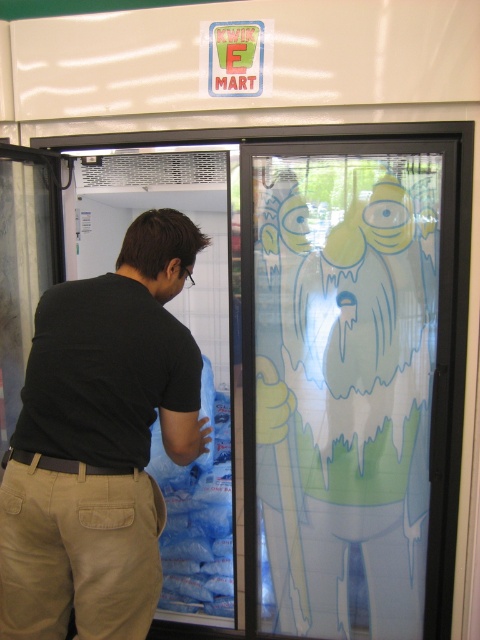
You are a store employee who needs to hang a small price tag on the refrigerator door. The tag must be placed at the height of the black matte shirt at center and the khaki cotton pants at lower left. Which object should you use to determine the lower hanging position?

The khaki cotton pants at lower left is shorter than the black matte shirt at center, so the lower hanging position should be determined using the khaki cotton pants at lower left.

You are a delivery person trying to deliver a package to the KWIK E MART store. You need to pass through the transparent plastic screen door at right and the khaki cotton pants at lower left. Which object should you go around first?

The khaki cotton pants at lower left should be navigated first since the transparent plastic screen door at right is larger and likely part of the entranceway, requiring you to first step over or move past the khaki cotton pants at lower left before approaching the door.